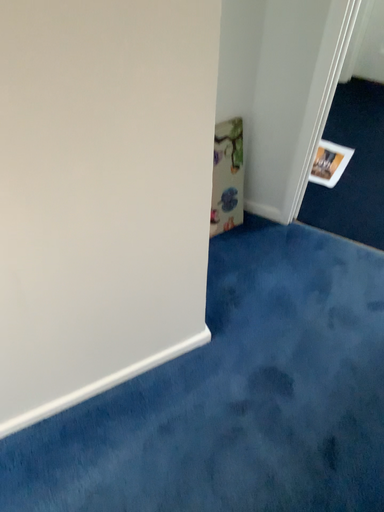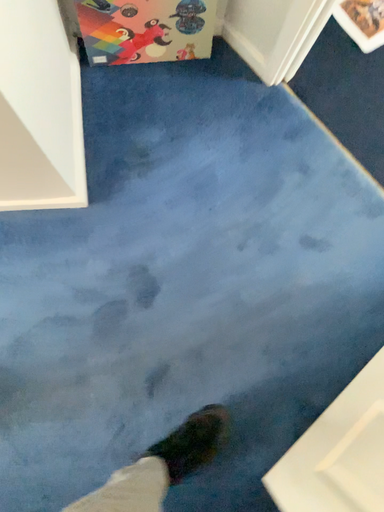
Question: How did the camera likely rotate when shooting the video?

Choices:
 (A) rotated upward
 (B) rotated downward

Answer: (B)